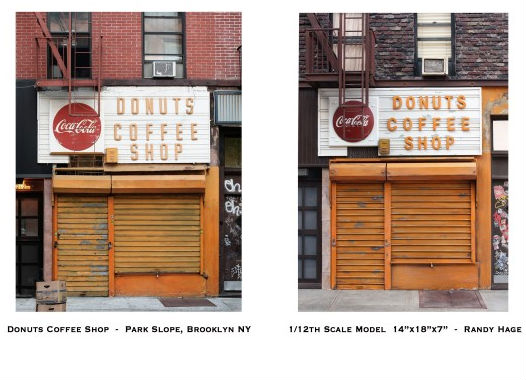
Locate an element on the screen. yellow roll down cover is located at coordinates click(x=401, y=222).